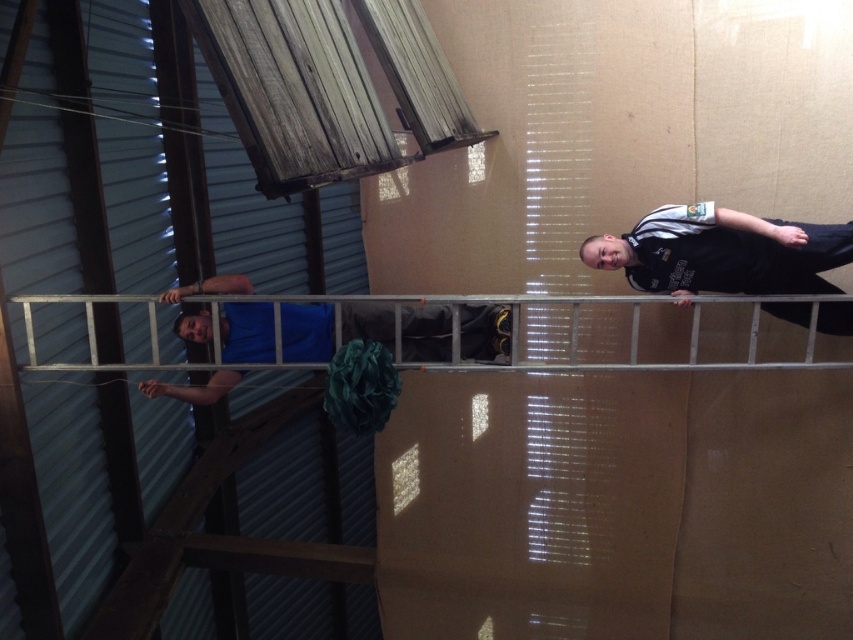
Based on the photo, you are standing at the point with coordinates point (722, 252). Which object is located at that point?

The point (722, 252) corresponds to the black jersey at right.

You are an observer in the workshop. You see the blue fabric at center and the silver metallic ladder at center. Which object takes up more space in the image?

The blue fabric at center is larger in size than the silver metallic ladder at center, so it takes up more space in the image.